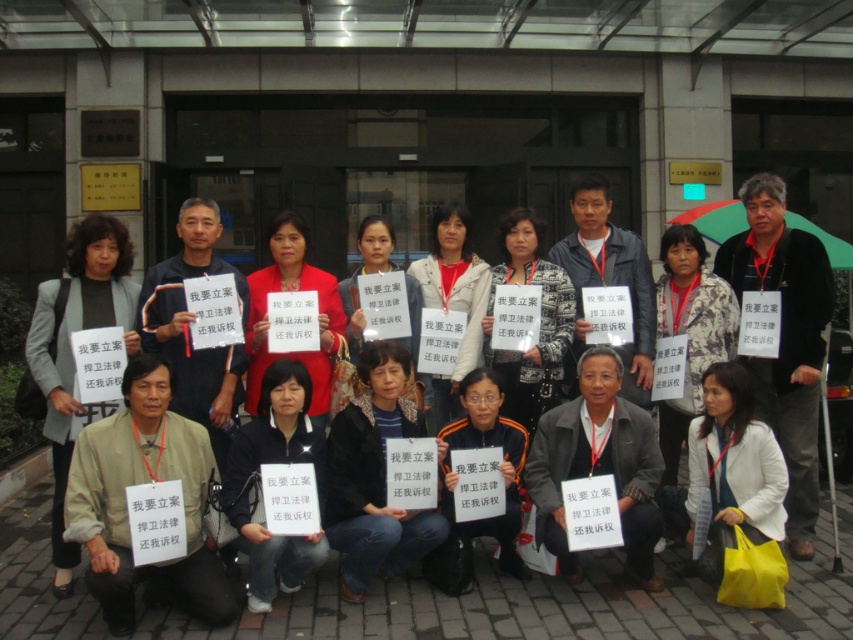
Question: Does matte black sign at center appear under matte red coat at center?

Choices:
 (A) no
 (B) yes

Answer: (A)

Question: Considering the real-world distances, which object is closest to the matte red coat at center?

Choices:
 (A) matte black sign at center
 (B) light brown fabric shirt at lower left

Answer: (B)

Question: Where is matte black sign at center located in relation to matte red coat at center in the image?

Choices:
 (A) below
 (B) above

Answer: (B)

Question: Does black fabric jacket at center appear on the left side of matte red coat at center?

Choices:
 (A) yes
 (B) no

Answer: (B)

Question: Which point is farther to the camera?

Choices:
 (A) (578, 218)
 (B) (314, 275)
 (C) (134, 301)
 (D) (154, 445)

Answer: (A)

Question: Which point is closer to the camera taking this photo?

Choices:
 (A) (590, 205)
 (B) (335, 317)
 (C) (54, 376)
 (D) (541, 410)

Answer: (C)